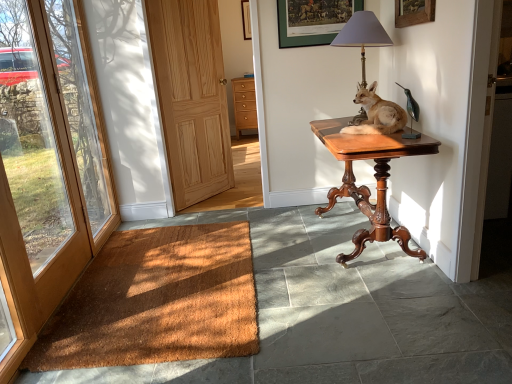
Identify the location of free point in front of mahogany wood table at center. This screenshot has width=512, height=384. (380, 311).